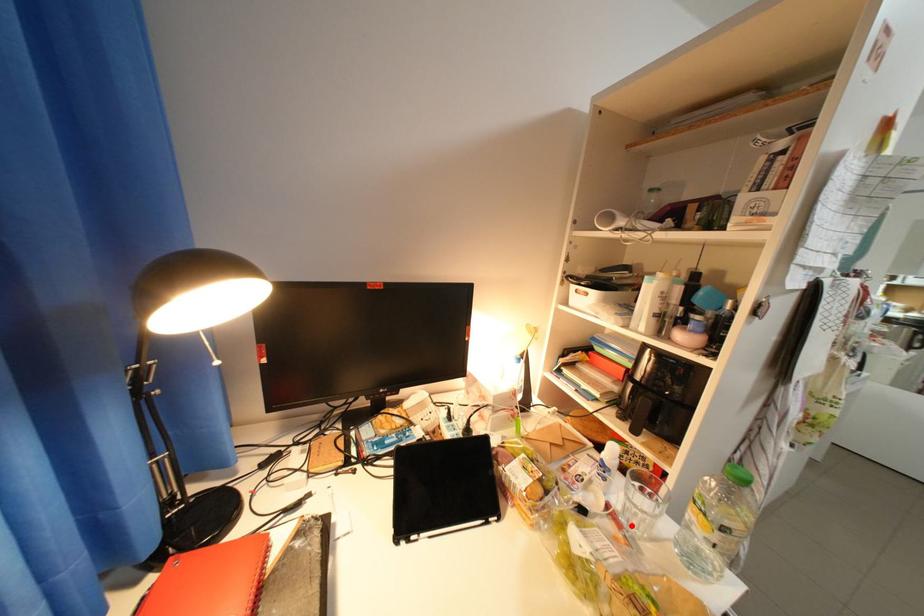
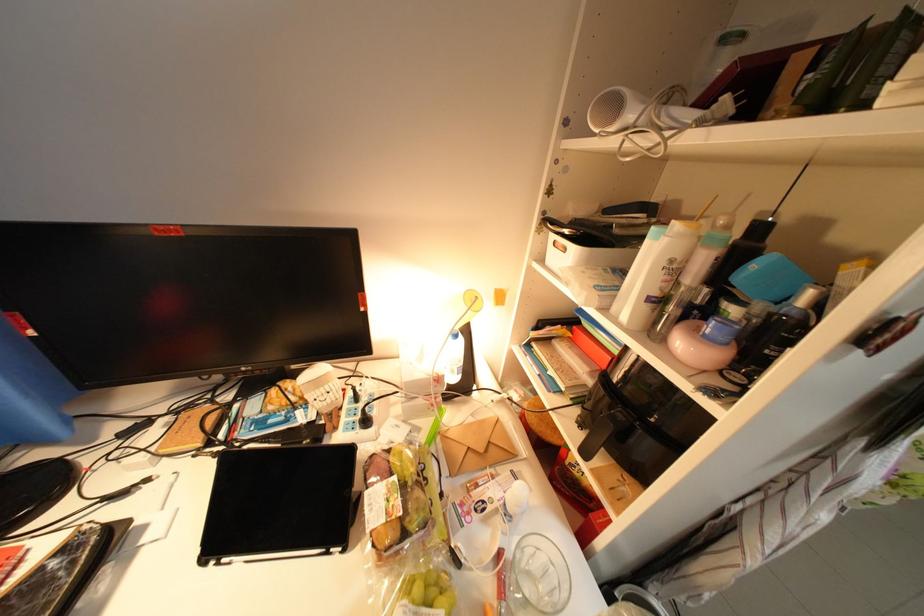
The point at the highlighted location is marked in the first image. Where is the corresponding point in the second image?

(514, 591)